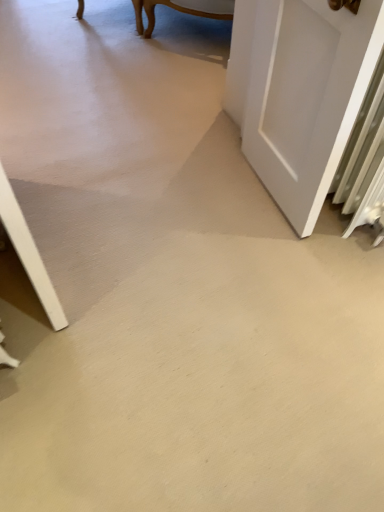
Question: Considering the relative sizes of white matte door at right and smooth concrete floor at center in the image provided, is white matte door at right shorter than smooth concrete floor at center?

Choices:
 (A) no
 (B) yes

Answer: (A)

Question: Can smooth concrete floor at center be found inside white matte door at right?

Choices:
 (A) yes
 (B) no

Answer: (B)

Question: Considering the relative sizes of white matte door at right and smooth concrete floor at center in the image provided, is white matte door at right taller than smooth concrete floor at center?

Choices:
 (A) yes
 (B) no

Answer: (A)

Question: Can you confirm if white matte door at right is bigger than smooth concrete floor at center?

Choices:
 (A) no
 (B) yes

Answer: (A)

Question: Would you say white matte door at right is a long distance from smooth concrete floor at center?

Choices:
 (A) yes
 (B) no

Answer: (B)

Question: Does white matte door at right have a smaller size compared to smooth concrete floor at center?

Choices:
 (A) no
 (B) yes

Answer: (B)

Question: Is smooth concrete floor at center facing towards white matte door at right?

Choices:
 (A) yes
 (B) no

Answer: (B)

Question: Considering the relative sizes of smooth concrete floor at center and white matte door at right in the image provided, is smooth concrete floor at center shorter than white matte door at right?

Choices:
 (A) yes
 (B) no

Answer: (A)

Question: Is smooth concrete floor at center at the left side of white matte door at right?

Choices:
 (A) yes
 (B) no

Answer: (A)

Question: Is smooth concrete floor at center smaller than white matte door at right?

Choices:
 (A) yes
 (B) no

Answer: (B)

Question: Is smooth concrete floor at center bigger than white matte door at right?

Choices:
 (A) yes
 (B) no

Answer: (A)

Question: Is smooth concrete floor at center further to camera compared to white matte door at right?

Choices:
 (A) no
 (B) yes

Answer: (A)

Question: Looking at the image, does white matte door at right seem bigger or smaller compared to smooth concrete floor at center?

Choices:
 (A) big
 (B) small

Answer: (B)